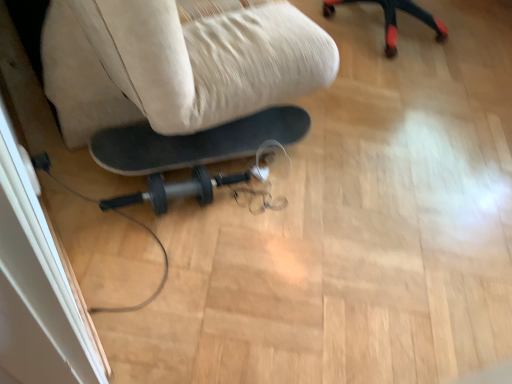
What are the coordinates of `transparent plastic screen door at lower left` in the screenshot? It's located at (37, 286).

Image resolution: width=512 pixels, height=384 pixels. Describe the element at coordinates (37, 286) in the screenshot. I see `transparent plastic screen door at lower left` at that location.

What do you see at coordinates (176, 63) in the screenshot? Image resolution: width=512 pixels, height=384 pixels. I see `beige fabric swivel chair at center` at bounding box center [176, 63].

Locate an element on the screen. The height and width of the screenshot is (384, 512). beige fabric swivel chair at center is located at coordinates (176, 63).

At what (x,y) coordinates should I click in order to perform the action: click on transparent plastic screen door at lower left. Please return your answer as a coordinate pair (x, y). Image resolution: width=512 pixels, height=384 pixels. Looking at the image, I should click on (37, 286).

Can you confirm if transparent plastic screen door at lower left is positioned to the left of beige fabric swivel chair at center?

Indeed, transparent plastic screen door at lower left is positioned on the left side of beige fabric swivel chair at center.

Consider the image. Considering the positions of objects transparent plastic screen door at lower left and beige fabric swivel chair at center in the image provided, who is in front, transparent plastic screen door at lower left or beige fabric swivel chair at center?

beige fabric swivel chair at center.

Does point (15, 282) come behind point (162, 132)?

No, (15, 282) is in front of (162, 132).

From the image's perspective, does transparent plastic screen door at lower left appear lower than beige fabric swivel chair at center?

Indeed, from the image's perspective, transparent plastic screen door at lower left is shown beneath beige fabric swivel chair at center.

From a real-world perspective, is transparent plastic screen door at lower left located beneath beige fabric swivel chair at center?

Correct, in the physical world, transparent plastic screen door at lower left is lower than beige fabric swivel chair at center.

Does transparent plastic screen door at lower left have a greater width compared to beige fabric swivel chair at center?

No.

Between transparent plastic screen door at lower left and beige fabric swivel chair at center, which one has more height?

beige fabric swivel chair at center is taller.

Can you confirm if transparent plastic screen door at lower left is smaller than beige fabric swivel chair at center?

Correct, transparent plastic screen door at lower left occupies less space than beige fabric swivel chair at center.

Would you say transparent plastic screen door at lower left contains beige fabric swivel chair at center?

No, beige fabric swivel chair at center is not inside transparent plastic screen door at lower left.

Is the surface of transparent plastic screen door at lower left in direct contact with beige fabric swivel chair at center?

No, transparent plastic screen door at lower left is not with beige fabric swivel chair at center.

Is transparent plastic screen door at lower left facing away from beige fabric swivel chair at center?

No, beige fabric swivel chair at center is not at the back of transparent plastic screen door at lower left.

What's the angular difference between transparent plastic screen door at lower left and beige fabric swivel chair at center's facing directions?

They differ by 0.853 degrees in their facing directions.

How much distance is there between transparent plastic screen door at lower left and beige fabric swivel chair at center?

29.43 inches.

At what (x,y) coordinates should I click in order to perform the action: click on swivel chair in front of the transparent plastic screen door at lower left. Please return your answer as a coordinate pair (x, y). Looking at the image, I should click on (176, 63).

Based on their positions, is beige fabric swivel chair at center located to the left or right of transparent plastic screen door at lower left?

In the image, beige fabric swivel chair at center appears on the right side of transparent plastic screen door at lower left.

Relative to transparent plastic screen door at lower left, is beige fabric swivel chair at center in front or behind?

Visually, beige fabric swivel chair at center is located in front of transparent plastic screen door at lower left.

Does point (162, 105) come farther from viewer compared to point (78, 315)?

Yes, it is behind point (78, 315).

From the image's perspective, which is below, beige fabric swivel chair at center or transparent plastic screen door at lower left?

transparent plastic screen door at lower left, from the image's perspective.

From a real-world perspective, is beige fabric swivel chair at center positioned over transparent plastic screen door at lower left based on gravity?

Yes, from a real-world perspective, beige fabric swivel chair at center is over transparent plastic screen door at lower left

Considering the relative sizes of beige fabric swivel chair at center and transparent plastic screen door at lower left in the image provided, is beige fabric swivel chair at center thinner than transparent plastic screen door at lower left?

No.

Which of these two, beige fabric swivel chair at center or transparent plastic screen door at lower left, stands shorter?

With less height is transparent plastic screen door at lower left.

Can you confirm if beige fabric swivel chair at center is smaller than transparent plastic screen door at lower left?

Actually, beige fabric swivel chair at center might be larger than transparent plastic screen door at lower left.

Is transparent plastic screen door at lower left surrounded by beige fabric swivel chair at center?

That's incorrect, transparent plastic screen door at lower left is not inside beige fabric swivel chair at center.

Are beige fabric swivel chair at center and transparent plastic screen door at lower left far apart?

No, beige fabric swivel chair at center is not far away from transparent plastic screen door at lower left.

Could you tell me if beige fabric swivel chair at center is facing transparent plastic screen door at lower left?

No, beige fabric swivel chair at center is not aimed at transparent plastic screen door at lower left.

Can you tell me how much beige fabric swivel chair at center and transparent plastic screen door at lower left differ in facing direction?

0.853 degrees.

Measure the distance between beige fabric swivel chair at center and transparent plastic screen door at lower left.

beige fabric swivel chair at center is 29.43 inches from transparent plastic screen door at lower left.

In the image, there is a beige fabric swivel chair at center. Where is `screen door below it (from the image's perspective)`? This screenshot has width=512, height=384. screen door below it (from the image's perspective) is located at coordinates (37, 286).

Image resolution: width=512 pixels, height=384 pixels. I want to click on screen door below the beige fabric swivel chair at center (from a real-world perspective), so click(37, 286).

Image resolution: width=512 pixels, height=384 pixels. I want to click on screen door below the beige fabric swivel chair at center (from the image's perspective), so click(x=37, y=286).